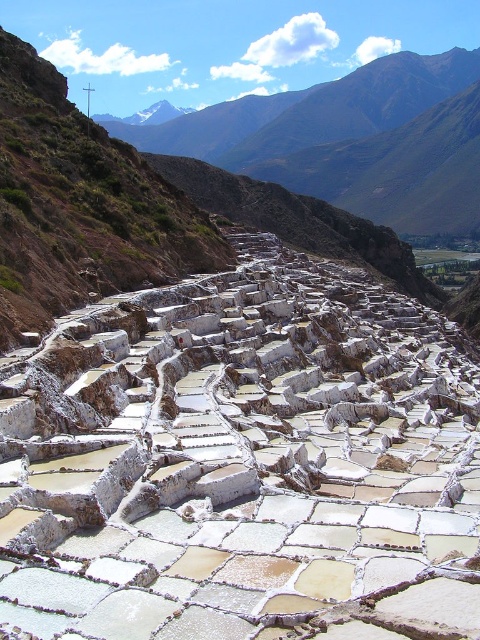
Between white stone at center and rugged brown mountain at upper center, which one has more height?

rugged brown mountain at upper center is taller.

Does white stone at center have a greater height compared to rugged brown mountain at upper center?

Incorrect, white stone at center's height is not larger of rugged brown mountain at upper center's.

The image size is (480, 640). What do you see at coordinates (242, 461) in the screenshot?
I see `white stone at center` at bounding box center [242, 461].

This screenshot has height=640, width=480. What are the coordinates of `white stone at center` in the screenshot? It's located at (242, 461).